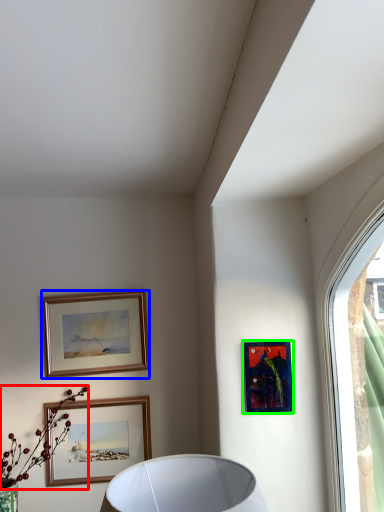
Question: Which object is positioned closest to flower (highlighted by a red box)? Select from picture frame (highlighted by a blue box) and picture frame (highlighted by a green box).

Choices:
 (A) picture frame
 (B) picture frame

Answer: (A)